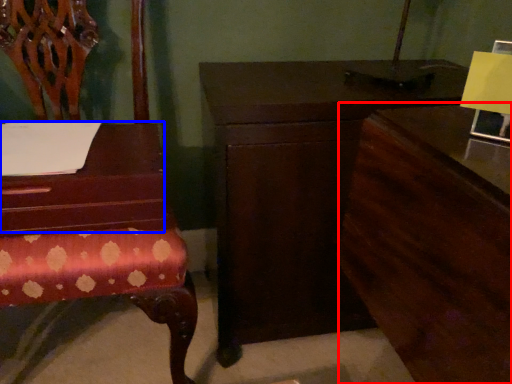
Question: Which of the following is the farthest to the observer, dresser (highlighted by a red box) or table (highlighted by a blue box)?

Choices:
 (A) dresser
 (B) table

Answer: (B)